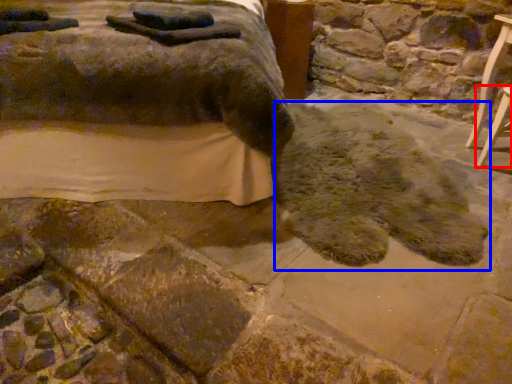
Question: Which of the following is the closest to the observer, furniture (highlighted by a red box) or footprint (highlighted by a blue box)?

Choices:
 (A) furniture
 (B) footprint

Answer: (B)